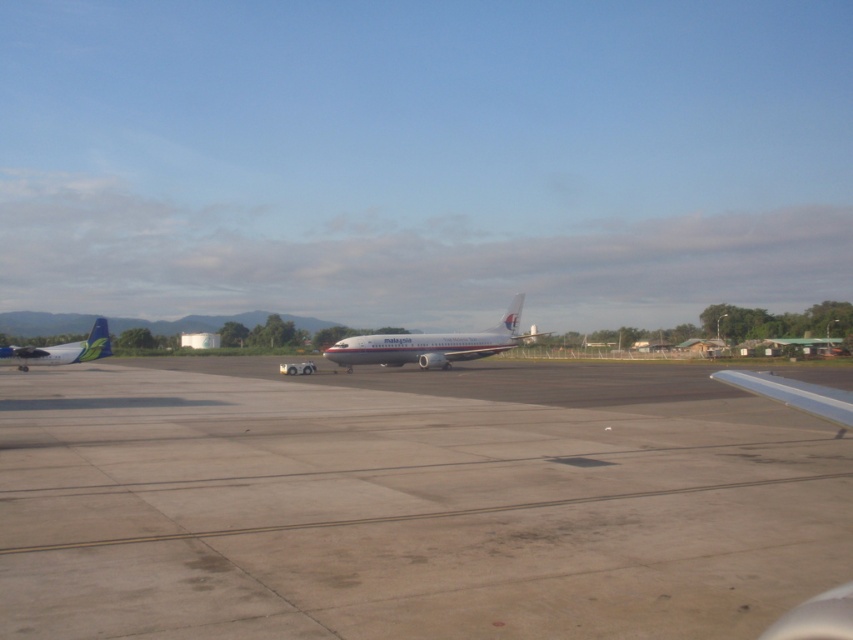
Question: Is gray concrete runway at center positioned behind matte white airplane at left?

Choices:
 (A) no
 (B) yes

Answer: (A)

Question: Is gray concrete runway at center smaller than white metallic airplane at center?

Choices:
 (A) yes
 (B) no

Answer: (A)

Question: Among these objects, which one is nearest to the camera?

Choices:
 (A) matte white airplane at left
 (B) white metallic airplane at center
 (C) gray concrete runway at center

Answer: (C)

Question: Is gray concrete runway at center below white metallic airplane at center?

Choices:
 (A) yes
 (B) no

Answer: (A)

Question: Which object is closer to the camera taking this photo?

Choices:
 (A) matte white airplane at left
 (B) white metallic airplane at center
 (C) gray concrete runway at center

Answer: (C)

Question: Considering the real-world distances, which object is closest to the matte white airplane at left?

Choices:
 (A) white metallic airplane at center
 (B) gray concrete runway at center

Answer: (A)